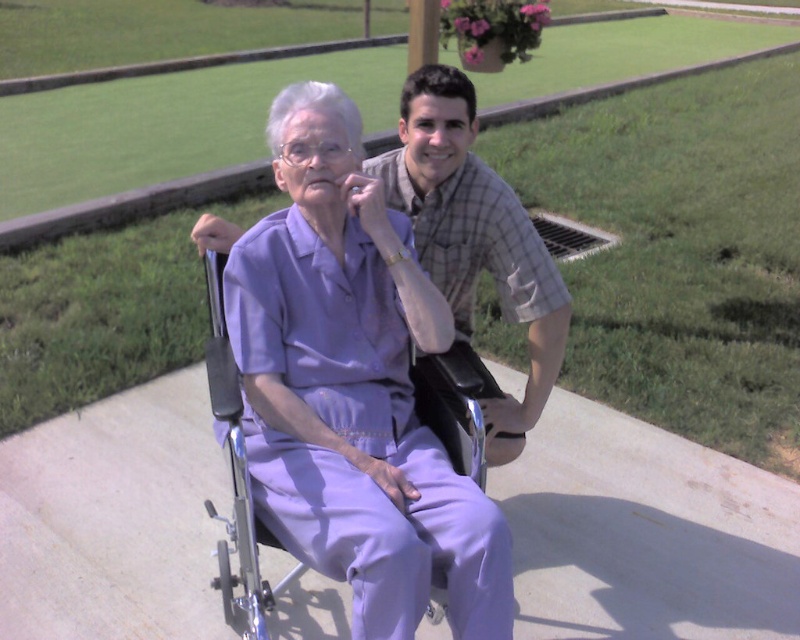
Is plaid cotton shirt at center shorter than metallic silver wheelchair at center?

No.

Is plaid cotton shirt at center in front of metallic silver wheelchair at center?

No, it is not.

The width and height of the screenshot is (800, 640). Describe the element at coordinates (474, 237) in the screenshot. I see `plaid cotton shirt at center` at that location.

At what (x,y) coordinates should I click in order to perform the action: click on plaid cotton shirt at center. Please return your answer as a coordinate pair (x, y). This screenshot has height=640, width=800. Looking at the image, I should click on coord(474,237).